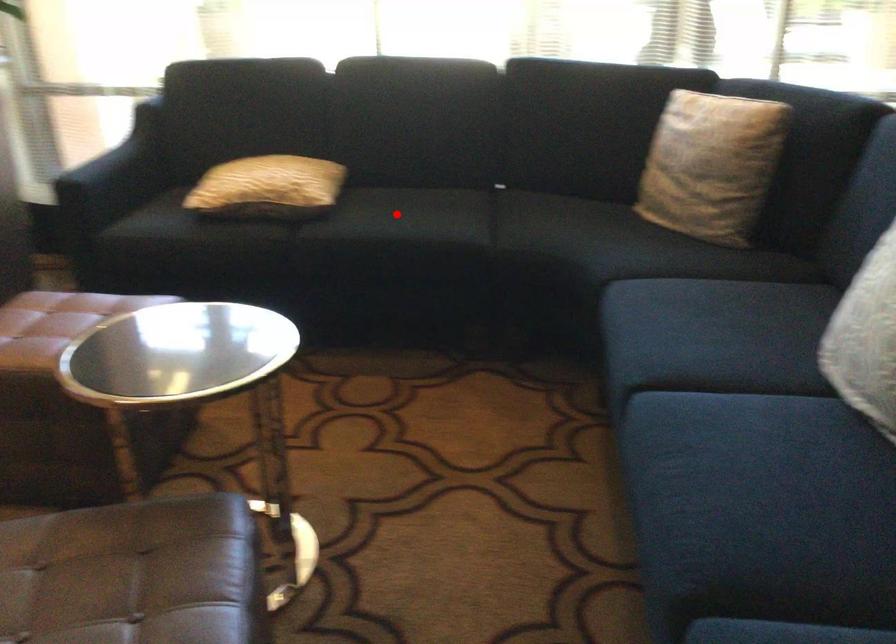
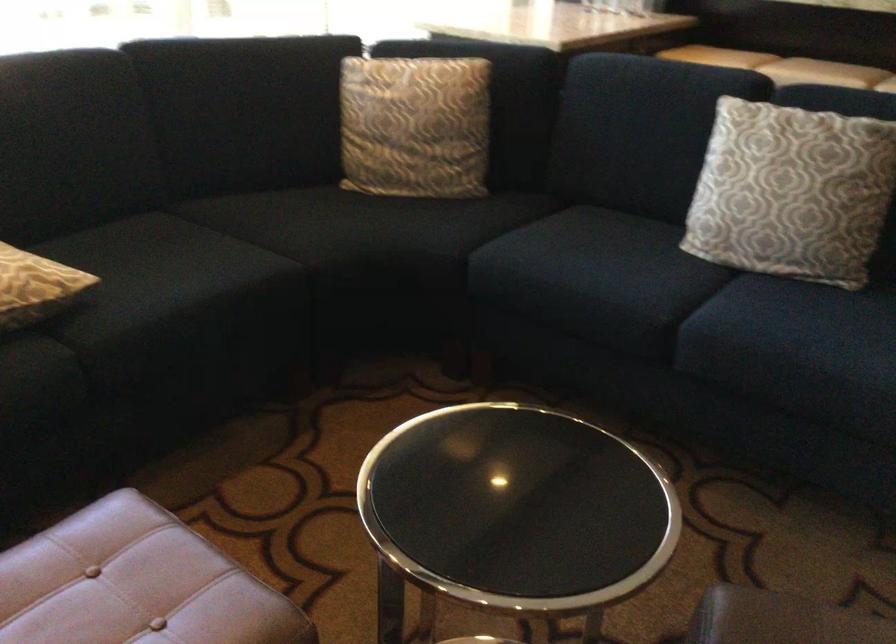
Question: A red point is marked in image1. In image2, is the corresponding 3D point closer to the camera or farther? Reply with the corresponding letter.

Choices:
 (A) The corresponding 3D point is closer.
 (B) The corresponding 3D point is farther.

Answer: (A)